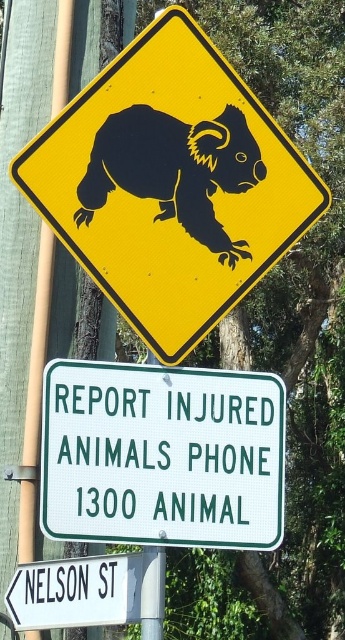
You are a driver approaching the wildlife crossing sign and need to report an injured animal. You see the black plastic koala at upper center and the green metal sign at center. Which one is taller?

The black plastic koala at upper center is taller than the green metal sign at center.

You are a driver approaching the wildlife crossing sign and need to locate the black matte koala at center. Based on the coordinates provided, can you determine if the koala is positioned closer to the top or bottom half of the sign?

The black matte koala at center is located at coordinates point [174,170]. Since the y coordinate is 0.507, which is just above the halfway point of the sign, the koala is positioned slightly closer to the bottom half of the sign.